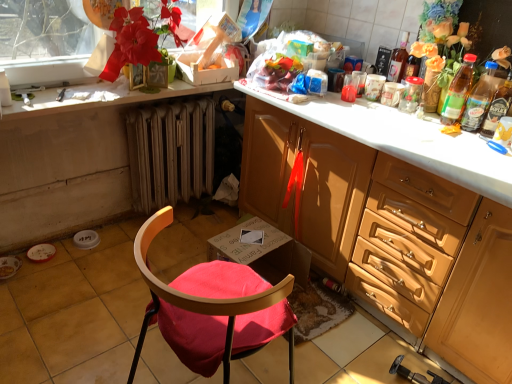
Find the location of `free point to the left of velvet red chair at lower left`. free point to the left of velvet red chair at lower left is located at coordinates (110, 345).